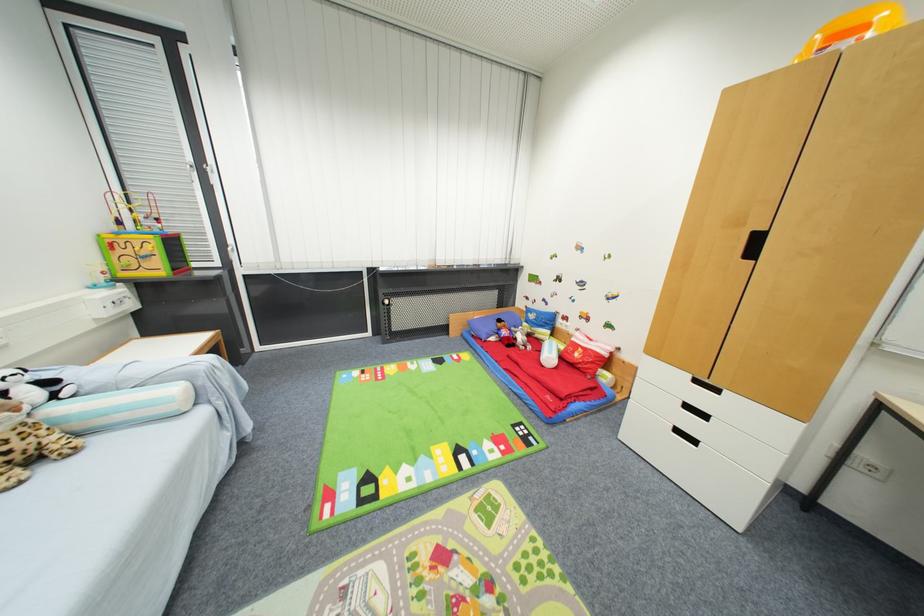
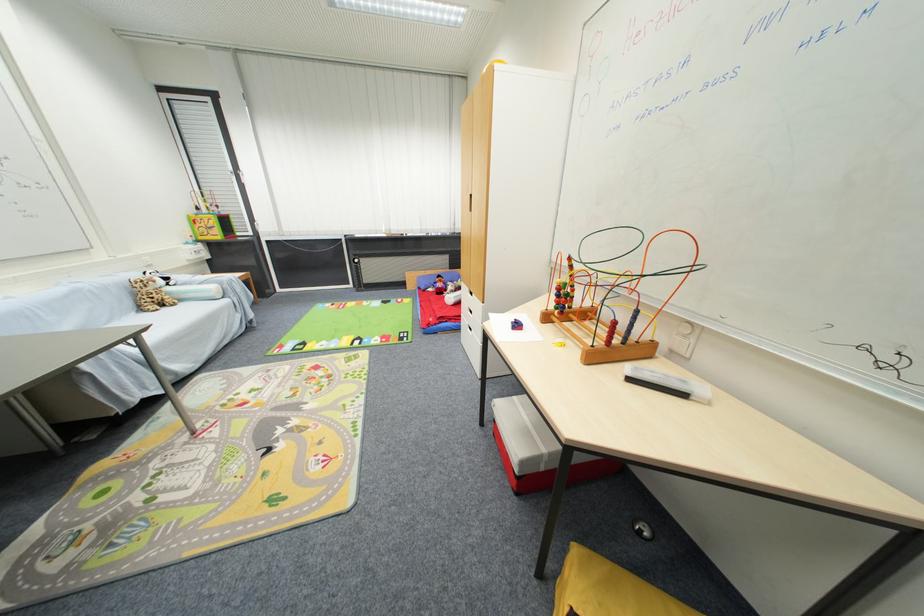
Find the pixel in the second image that matches (691,408) in the first image.

(473, 310)